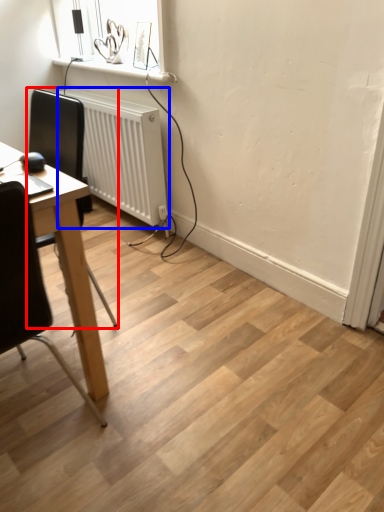
Question: Which point is closer to the camera, chair (highlighted by a red box) or radiator (highlighted by a blue box)?

Choices:
 (A) chair
 (B) radiator

Answer: (A)